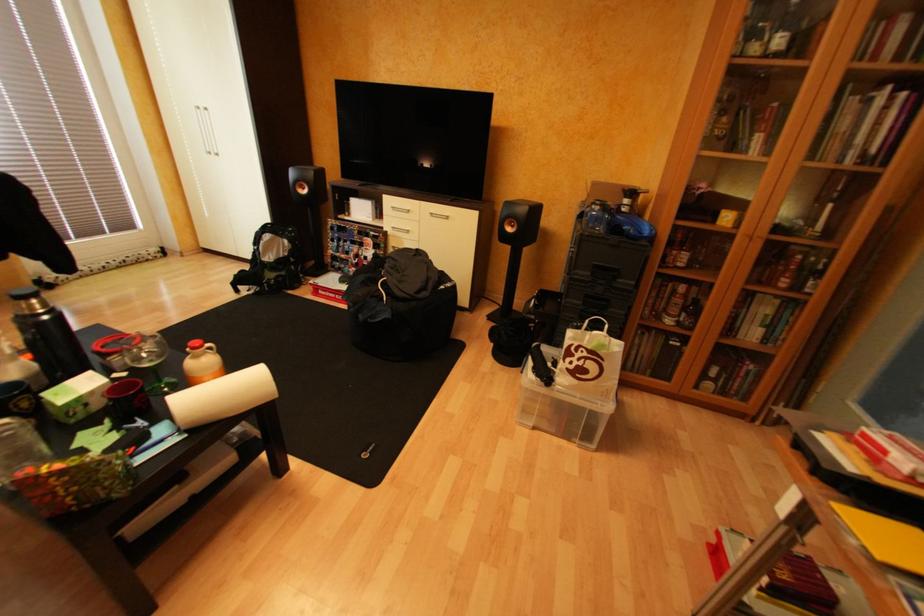
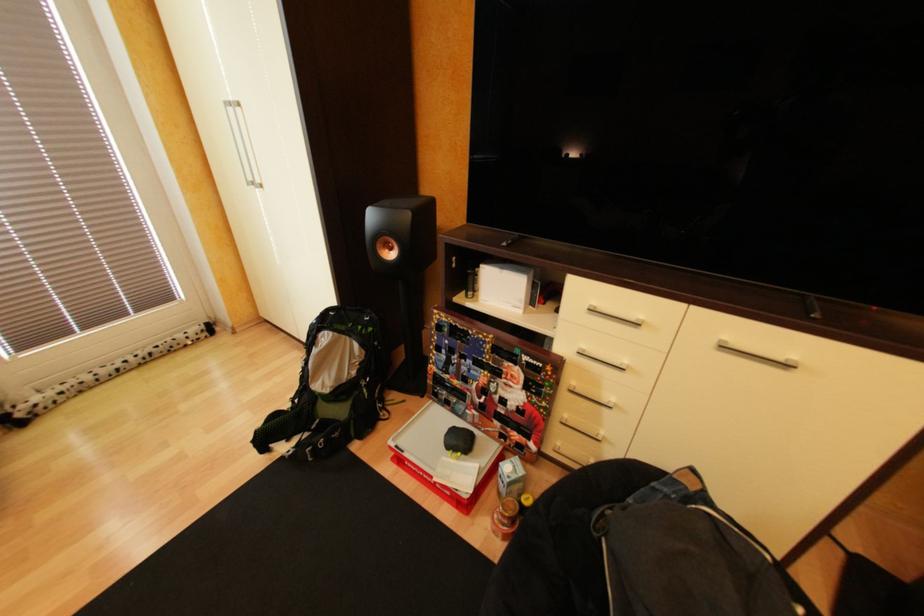
What movement of the cameraman would produce the second image?

The cameraman walked toward left, forward.